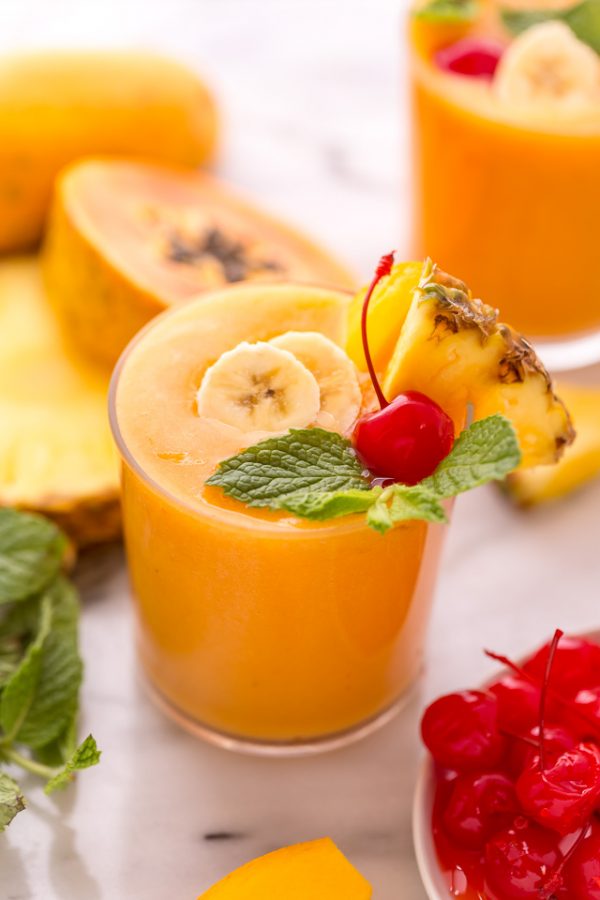
What are the coordinates of `white table` in the screenshot? It's located at (511, 582).